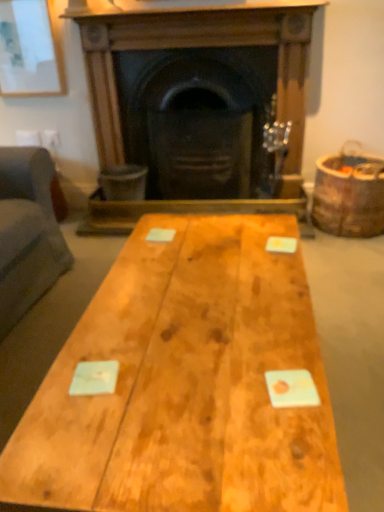
Question: Considering the relative sizes of matte white picture frame at upper left and natural wood table at center in the image provided, is matte white picture frame at upper left bigger than natural wood table at center?

Choices:
 (A) no
 (B) yes

Answer: (A)

Question: Is matte white picture frame at upper left outside of natural wood table at center?

Choices:
 (A) no
 (B) yes

Answer: (B)

Question: Does matte white picture frame at upper left have a lesser width compared to natural wood table at center?

Choices:
 (A) no
 (B) yes

Answer: (B)

Question: Can you confirm if matte white picture frame at upper left is wider than natural wood table at center?

Choices:
 (A) yes
 (B) no

Answer: (B)

Question: Is matte white picture frame at upper left taller than natural wood table at center?

Choices:
 (A) yes
 (B) no

Answer: (A)

Question: Can you confirm if matte white picture frame at upper left is positioned to the left of natural wood table at center?

Choices:
 (A) no
 (B) yes

Answer: (B)

Question: Is wooden fireplace at center shorter than natural wood table at center?

Choices:
 (A) yes
 (B) no

Answer: (B)

Question: Is wooden fireplace at center wider than natural wood table at center?

Choices:
 (A) yes
 (B) no

Answer: (B)

Question: Is wooden fireplace at center at the left side of natural wood table at center?

Choices:
 (A) no
 (B) yes

Answer: (A)

Question: Is wooden fireplace at center positioned behind natural wood table at center?

Choices:
 (A) no
 (B) yes

Answer: (B)

Question: Does wooden fireplace at center have a smaller size compared to natural wood table at center?

Choices:
 (A) yes
 (B) no

Answer: (B)

Question: Is wooden fireplace at center taller than natural wood table at center?

Choices:
 (A) yes
 (B) no

Answer: (A)

Question: Is brown wooden barrel at right bigger than matte white picture frame at upper left?

Choices:
 (A) yes
 (B) no

Answer: (A)